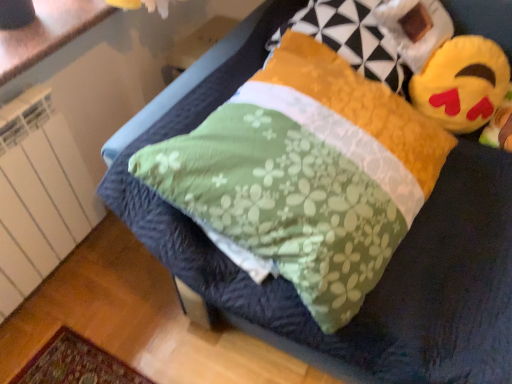
Question: Could you tell me if yellow plush toy at upper right is turned towards fluffy yellow pillow at upper right?

Choices:
 (A) yes
 (B) no

Answer: (B)

Question: Is yellow plush toy at upper right outside fluffy yellow pillow at upper right?

Choices:
 (A) no
 (B) yes

Answer: (B)

Question: From a real-world perspective, does yellow plush toy at upper right sit lower than fluffy yellow pillow at upper right?

Choices:
 (A) no
 (B) yes

Answer: (B)

Question: Is fluffy yellow pillow at upper right at the back of yellow plush toy at upper right?

Choices:
 (A) yes
 (B) no

Answer: (B)

Question: From the image's perspective, is yellow plush toy at upper right located beneath fluffy yellow pillow at upper right?

Choices:
 (A) no
 (B) yes

Answer: (B)

Question: Considering the relative sizes of yellow plush toy at upper right and fluffy yellow pillow at upper right in the image provided, is yellow plush toy at upper right shorter than fluffy yellow pillow at upper right?

Choices:
 (A) no
 (B) yes

Answer: (B)

Question: Is fluffy yellow pillow at upper right taller than yellow plush toy at upper right?

Choices:
 (A) no
 (B) yes

Answer: (B)

Question: From the image's perspective, is fluffy yellow pillow at upper right under yellow plush toy at upper right?

Choices:
 (A) no
 (B) yes

Answer: (A)

Question: From a real-world perspective, is fluffy yellow pillow at upper right below yellow plush toy at upper right?

Choices:
 (A) no
 (B) yes

Answer: (A)

Question: Is fluffy yellow pillow at upper right located outside yellow plush toy at upper right?

Choices:
 (A) no
 (B) yes

Answer: (B)

Question: Are fluffy yellow pillow at upper right and yellow plush toy at upper right making contact?

Choices:
 (A) no
 (B) yes

Answer: (A)

Question: Can you confirm if fluffy yellow pillow at upper right is smaller than yellow plush toy at upper right?

Choices:
 (A) no
 (B) yes

Answer: (A)

Question: Is white glossy countertop at upper left in contact with yellow plush toy at upper right?

Choices:
 (A) yes
 (B) no

Answer: (B)